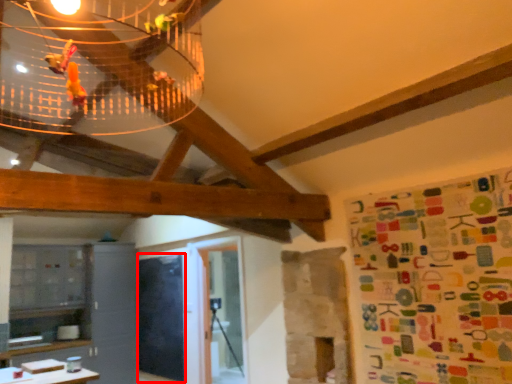
Question: Observing the image, what is the correct spatial positioning of bulletin board (annotated by the red box) in reference to wrapping paper?

Choices:
 (A) right
 (B) left

Answer: (B)